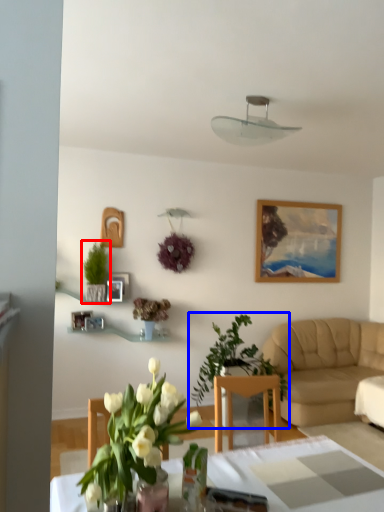
Question: Among these objects, which one is nearest to the camera, houseplant (highlighted by a red box) or houseplant (highlighted by a blue box)?

Choices:
 (A) houseplant
 (B) houseplant

Answer: (B)